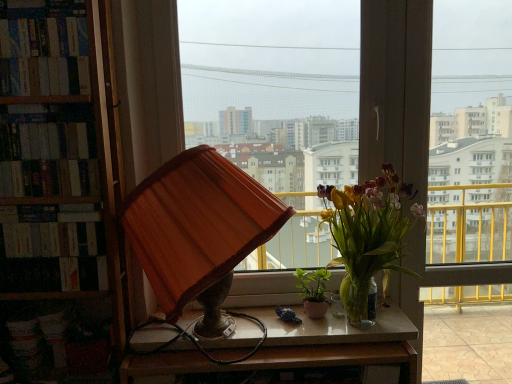
Question: Does hardcover book at left, which appears as the first book when ordered from the bottom, have a larger size compared to transparent glass window at center, which is the 1th window from right to left?

Choices:
 (A) no
 (B) yes

Answer: (A)

Question: Does hardcover book at left, the 3th book in the top-to-bottom sequence, have a greater height compared to transparent glass window at center, positioned as the second window in left-to-right order?

Choices:
 (A) no
 (B) yes

Answer: (A)

Question: Is transparent glass window at center, positioned as the second window in left-to-right order, inside hardcover book at left, the 3th book in the top-to-bottom sequence?

Choices:
 (A) no
 (B) yes

Answer: (A)

Question: Is hardcover book at left, which appears as the first book when ordered from the bottom, at the right side of transparent glass window at center, positioned as the second window in left-to-right order?

Choices:
 (A) yes
 (B) no

Answer: (B)

Question: From a real-world perspective, does hardcover book at left, the 3th book in the top-to-bottom sequence, sit lower than transparent glass window at center, positioned as the second window in left-to-right order?

Choices:
 (A) yes
 (B) no

Answer: (B)

Question: Looking at their shapes, would you say hardcover books at left, placed as the second book when sorted from top to bottom, is wider or thinner than orange fabric lampshade at center?

Choices:
 (A) wide
 (B) thin

Answer: (B)

Question: From their relative heights in the image, would you say hardcover books at left, the second book ordered from the bottom, is taller or shorter than orange fabric lampshade at center?

Choices:
 (A) tall
 (B) short

Answer: (B)

Question: From a real-world perspective, is hardcover books at left, placed as the second book when sorted from top to bottom, physically located above or below orange fabric lampshade at center?

Choices:
 (A) above
 (B) below

Answer: (A)

Question: Relative to orange fabric lampshade at center, is hardcover books at left, the second book ordered from the bottom, in front or behind?

Choices:
 (A) front
 (B) behind

Answer: (B)

Question: From the image's perspective, is hardcover books at left, the 3th book from the bottom, above or below matte wooden lampshade at center, the 1th window positioned from the left?

Choices:
 (A) below
 (B) above

Answer: (B)

Question: Considering the positions of hardcover books at left, the 1th book when ordered from top to bottom, and matte wooden lampshade at center, the 1th window positioned from the left, in the image, is hardcover books at left, the 1th book when ordered from top to bottom, wider or thinner than matte wooden lampshade at center, the 1th window positioned from the left,?

Choices:
 (A) wide
 (B) thin

Answer: (A)

Question: From a real-world perspective, is hardcover books at left, the 3th book from the bottom, positioned above or below matte wooden lampshade at center, the 1th window positioned from the left?

Choices:
 (A) below
 (B) above

Answer: (B)

Question: Considering the positions of hardcover books at left, the 1th book when ordered from top to bottom, and matte wooden lampshade at center, the second window positioned from the right, in the image, is hardcover books at left, the 1th book when ordered from top to bottom, bigger or smaller than matte wooden lampshade at center, the second window positioned from the right,?

Choices:
 (A) small
 (B) big

Answer: (A)

Question: Would you say hardcover books at left, the 3th book from the bottom, is to the left or to the right of hardcover book at left, the 3th book in the top-to-bottom sequence, in the picture?

Choices:
 (A) left
 (B) right

Answer: (B)

Question: From a real-world perspective, is hardcover books at left, the 1th book when ordered from top to bottom, positioned above or below hardcover book at left, the 3th book in the top-to-bottom sequence?

Choices:
 (A) above
 (B) below

Answer: (A)